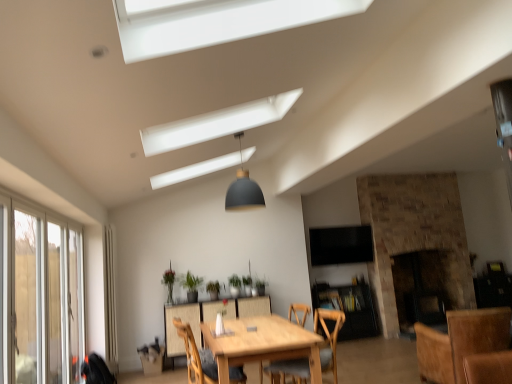
You are a GUI agent. You are given a task and a screenshot of the screen. Output one action in this format:
    pyautogui.click(x=<x>, y=<y>)
    Task: Click on the green matte plant at center, the second plant positioned from the right
    The height and width of the screenshot is (384, 512).
    Given the screenshot: What is the action you would take?
    pyautogui.click(x=213, y=287)

Measure the distance between green matte plant at center, the second plant positioned from the right, and camera.

They are 5.28 meters apart.

The image size is (512, 384). Describe the element at coordinates (190, 282) in the screenshot. I see `green matte plant at center, marked as the second plant in a left-to-right arrangement` at that location.

The width and height of the screenshot is (512, 384). What are the coordinates of `black glossy tv at upper center` in the screenshot? It's located at (341, 245).

The width and height of the screenshot is (512, 384). What do you see at coordinates (341, 245) in the screenshot? I see `black glossy tv at upper center` at bounding box center [341, 245].

Where is `green matte plant at center, the second plant positioned from the right`? This screenshot has height=384, width=512. green matte plant at center, the second plant positioned from the right is located at coordinates (x=213, y=287).

Which is in front, point (28, 383) or point (481, 350)?

The point (28, 383) is closer to the camera.

Is brown wooden chair at lower right, which is counted as the first chair, starting from the right, at the back of clear glass screen door at left?

No.

Considering the relative positions of clear glass screen door at left and brown wooden chair at lower right, which ranks as the third chair in left-to-right order, in the image provided, is clear glass screen door at left to the left or to the right of brown wooden chair at lower right, which ranks as the third chair in left-to-right order,?

clear glass screen door at left is to the left of brown wooden chair at lower right, which ranks as the third chair in left-to-right order.

Considering the sizes of objects clear glass screen door at left and brown wooden chair at lower right, which is counted as the first chair, starting from the right, in the image provided, who is bigger, clear glass screen door at left or brown wooden chair at lower right, which is counted as the first chair, starting from the right,?

Bigger between the two is brown wooden chair at lower right, which is counted as the first chair, starting from the right.

From the image's perspective, is brown wooden chair at lower right, which is counted as the first chair, starting from the right, positioned above or below black glass fireplace at center, the first fireplace in the right-to-left sequence?

Clearly, from the image's perspective, brown wooden chair at lower right, which is counted as the first chair, starting from the right, is above black glass fireplace at center, the first fireplace in the right-to-left sequence.

I want to click on the 1st chair above when counting from the black glass fireplace at center, the first fireplace in the right-to-left sequence (from the image's perspective), so click(460, 342).

Who is shorter, brown wooden chair at lower right, which ranks as the third chair in left-to-right order, or black glass fireplace at center, the first fireplace in the right-to-left sequence?

Standing shorter between the two is brown wooden chair at lower right, which ranks as the third chair in left-to-right order.

Measure the distance between brown wooden chair at lower right, which is counted as the first chair, starting from the right, and black glass fireplace at center, the first fireplace in the right-to-left sequence.

brown wooden chair at lower right, which is counted as the first chair, starting from the right, and black glass fireplace at center, the first fireplace in the right-to-left sequence, are 1.69 meters apart from each other.

From the image's perspective, is wooden table at center located above or below brick fireplace at right, the 2th fireplace viewed from the right?

Clearly, from the image's perspective, wooden table at center is below brick fireplace at right, the 2th fireplace viewed from the right.

What's the angular difference between wooden table at center and brick fireplace at right, which is the 1th fireplace from left to right,'s facing directions?

wooden table at center and brick fireplace at right, which is the 1th fireplace from left to right, are facing 0.559 degrees away from each other.

Is wooden table at center to the right of brick fireplace at right, which is the 1th fireplace from left to right, from the viewer's perspective?

No, wooden table at center is not to the right of brick fireplace at right, which is the 1th fireplace from left to right.

Is wooden table at center aimed at brick fireplace at right, which is the 1th fireplace from left to right?

No, wooden table at center is not oriented towards brick fireplace at right, which is the 1th fireplace from left to right.

Would you say wooden table at center is outside wooden chair at center, placed as the 2th chair when sorted from right to left?

Yes, wooden table at center is located beyond the bounds of wooden chair at center, placed as the 2th chair when sorted from right to left.

Considering the sizes of objects wooden table at center and wooden chair at center, placed as the 2th chair when sorted from right to left, in the image provided, who is taller, wooden table at center or wooden chair at center, placed as the 2th chair when sorted from right to left,?

With more height is wooden table at center.

Is wooden table at center bigger or smaller than wooden chair at center, placed as the 2th chair when sorted from right to left?

wooden table at center is bigger than wooden chair at center, placed as the 2th chair when sorted from right to left.

From the image's perspective, is green matte plant at center, marked as the first plant in a left-to-right arrangement, positioned above or below black glass fireplace at center, the 2th fireplace positioned from the left?

From the image's perspective, green matte plant at center, marked as the first plant in a left-to-right arrangement, appears above black glass fireplace at center, the 2th fireplace positioned from the left.

Is green matte plant at center, marked as the first plant in a left-to-right arrangement, to the left of black glass fireplace at center, the first fireplace in the right-to-left sequence, from the viewer's perspective?

Yes, green matte plant at center, marked as the first plant in a left-to-right arrangement, is to the left of black glass fireplace at center, the first fireplace in the right-to-left sequence.

Does green matte plant at center, marked as the first plant in a left-to-right arrangement, have a greater width compared to black glass fireplace at center, the 2th fireplace positioned from the left?

Incorrect, the width of green matte plant at center, marked as the first plant in a left-to-right arrangement, does not surpass that of black glass fireplace at center, the 2th fireplace positioned from the left.

There is a green matte plant at center, positioned as the 3th plant in left-to-right order. At what (x,y) coordinates should I click in order to perform the action: click on the 2nd chair below it (from a real-world perspective). Please return your answer as a coordinate pair (x, y). The image size is (512, 384). Looking at the image, I should click on (329, 337).

Is wooden chair at center, the 2th chair when ordered from left to right, in front of or behind green matte plant at center, the second plant positioned from the right, in the image?

wooden chair at center, the 2th chair when ordered from left to right, is in front of green matte plant at center, the second plant positioned from the right.

Is wooden chair at center, placed as the 2th chair when sorted from right to left, facing away from green matte plant at center, the second plant positioned from the right?

wooden chair at center, placed as the 2th chair when sorted from right to left, does not have its back to green matte plant at center, the second plant positioned from the right.

Considering the sizes of objects wooden chair at center, the 2th chair when ordered from left to right, and green matte plant at center, the second plant positioned from the right, in the image provided, who is wider, wooden chair at center, the 2th chair when ordered from left to right, or green matte plant at center, the second plant positioned from the right,?

With larger width is wooden chair at center, the 2th chair when ordered from left to right.

Considering the positions of objects matte gray dome at center and green matte plant at center, marked as the second plant in a left-to-right arrangement, in the image provided, who is more to the right, matte gray dome at center or green matte plant at center, marked as the second plant in a left-to-right arrangement,?

From the viewer's perspective, matte gray dome at center appears more on the right side.

In the scene shown: Is green matte plant at center, placed as the third plant when sorted from right to left, completely or partially inside matte gray dome at center?

No, green matte plant at center, placed as the third plant when sorted from right to left, is not surrounded by matte gray dome at center.

Where is `the 3rd chair to the right of the clear glass screen door at left, counting from the anchor's position`? the 3rd chair to the right of the clear glass screen door at left, counting from the anchor's position is located at coordinates (460, 342).

I want to click on the 1st fireplace located above the brown wooden chair at lower right, which ranks as the third chair in left-to-right order (from a real-world perspective), so click(420, 290).

When comparing their distances from wooden table at center, does wooden chair at center, the third chair positioned from the right, or brown wooden chair at lower right, which ranks as the third chair in left-to-right order, seem closer?

The object closer to wooden table at center is wooden chair at center, the third chair positioned from the right.

Estimate the real-world distances between objects in this image. Which object is closer to wooden table at center, brick fireplace at right, the 2th fireplace viewed from the right, or black glossy tv at upper center?

black glossy tv at upper center lies closer to wooden table at center than the other object.

From the image, which object appears to be nearer to brick fireplace at right, the 2th fireplace viewed from the right, black glossy tv at upper center or light brown wooden table at center?

black glossy tv at upper center is positioned closer to the anchor brick fireplace at right, the 2th fireplace viewed from the right.

Considering their positions, is wooden table at center positioned closer to wooden chair at center, which is counted as the 1th chair, starting from the left, than green matte plant at center, marked as the second plant in a left-to-right arrangement?

wooden table at center is positioned closer to the anchor wooden chair at center, which is counted as the 1th chair, starting from the left.

Considering their positions, is matte gray dome at center positioned further to black glass fireplace at center, the 2th fireplace positioned from the left, than black glossy tv at upper center?

Among the two, matte gray dome at center is located further to black glass fireplace at center, the 2th fireplace positioned from the left.

Looking at the image, which one is located further to green matte plant at center, positioned as the 1th plant in right-to-left order, green matte plant at center, acting as the fourth plant starting from the right, or brick fireplace at right, the 2th fireplace viewed from the right?

brick fireplace at right, the 2th fireplace viewed from the right, is positioned further to the anchor green matte plant at center, positioned as the 1th plant in right-to-left order.

Which object lies nearer to the anchor point green matte plant at center, acting as the fourth plant starting from the right, green matte plant at center, the second plant positioned from the right, or matte gray dome at center?

green matte plant at center, the second plant positioned from the right, is closer to green matte plant at center, acting as the fourth plant starting from the right.

Considering their positions, is light brown wooden table at center positioned closer to wooden chair at center, the 2th chair when ordered from left to right, than brick fireplace at right, the 2th fireplace viewed from the right?

light brown wooden table at center lies closer to wooden chair at center, the 2th chair when ordered from left to right, than the other object.

The height and width of the screenshot is (384, 512). Identify the location of chair between wooden chair at center, the 2th chair when ordered from left to right, and black glossy tv at upper center from front to back. (460, 342).

Where is `table situated between green matte plant at center, marked as the second plant in a left-to-right arrangement, and black glass fireplace at center, the first fireplace in the right-to-left sequence, from left to right`? table situated between green matte plant at center, marked as the second plant in a left-to-right arrangement, and black glass fireplace at center, the first fireplace in the right-to-left sequence, from left to right is located at coordinates (187, 322).

Find the location of a particular element. This screenshot has height=384, width=512. light fixture located between clear glass screen door at left and black glass fireplace at center, the 2th fireplace positioned from the left, in the left-right direction is located at coordinates (243, 189).

Identify the location of light fixture located between brown wooden chair at lower right, which ranks as the third chair in left-to-right order, and black glossy tv at upper center in the depth direction. (243, 189).